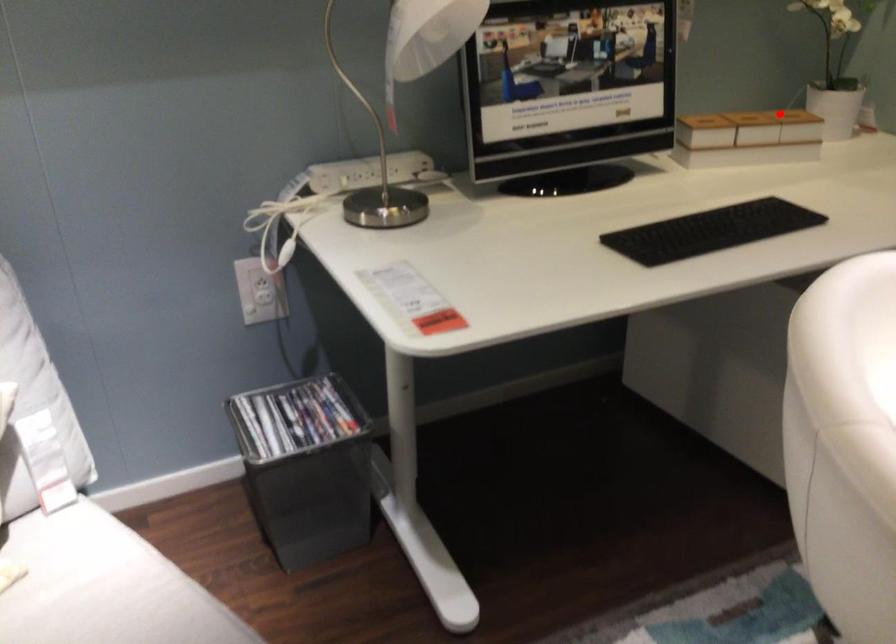
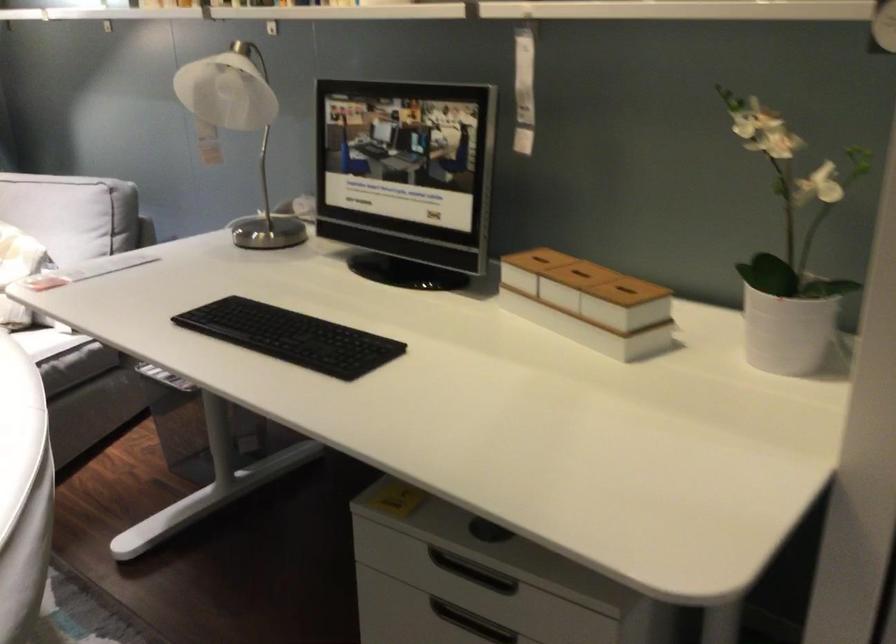
Where in the second image is the point corresponding to the highlighted location from the first image?

(579, 275)